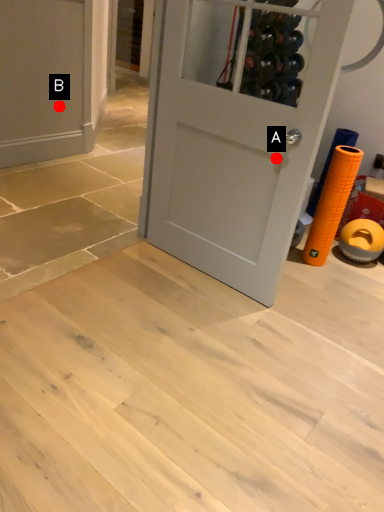
Question: Two points are circled on the image, labeled by A and B beside each circle. Which point is closer to the camera?

Choices:
 (A) A is closer
 (B) B is closer

Answer: (A)